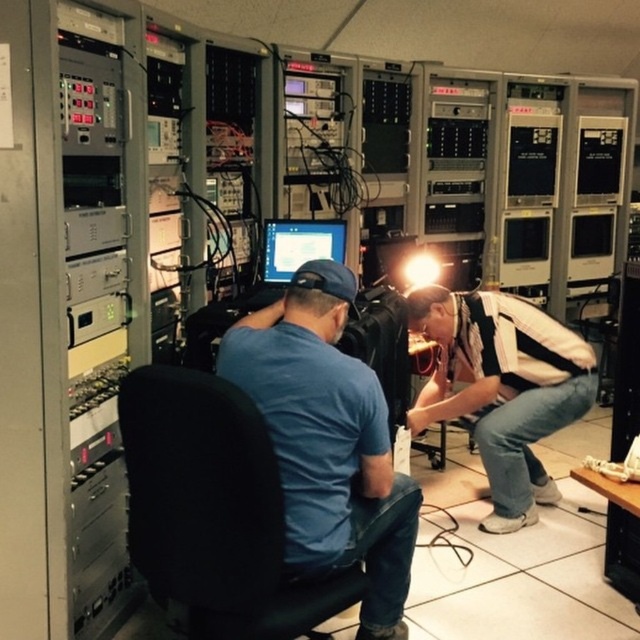
You are standing in the server room and want to locate the blue cotton shirt at center. According to the coordinates, where would you find it?

The blue cotton shirt at center is located at the 2D coordinates point (328, 442).

You are a technician who needs to adjust the position of the black fabric swivel chair at center and the matte black monitor at center. The required distance between them is 5 feet for ergonomic standards. Can you move the chair closer to the monitor to meet the requirement?

The current distance between the black fabric swivel chair at center and the matte black monitor at center is 4.90 feet. Since 4.90 feet is slightly less than the required 5 feet, moving the chair closer would reduce the distance further, making it even smaller than the ergonomic standard. Therefore, you should move the monitor slightly toward the chair instead to reach the 5 feet requirement.

You are a technician needing to move from your current position to the server rack located behind the black fabric swivel chair at center and the matte black monitor at center. Considering the space between the chair and the monitor, can you easily maneuver around them to reach the server rack?

Result: The black fabric swivel chair at center might be wider than the matte black monitor at center, so there could be sufficient space to maneuver around them to reach the server rack. However, the exact ease of movement depends on the specific widths of both objects.